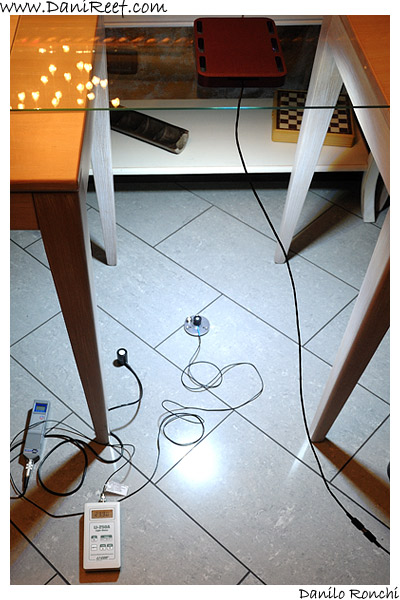
Image resolution: width=400 pixels, height=600 pixels. What are the coordinates of `tile floor` in the screenshot? It's located at (278, 480).